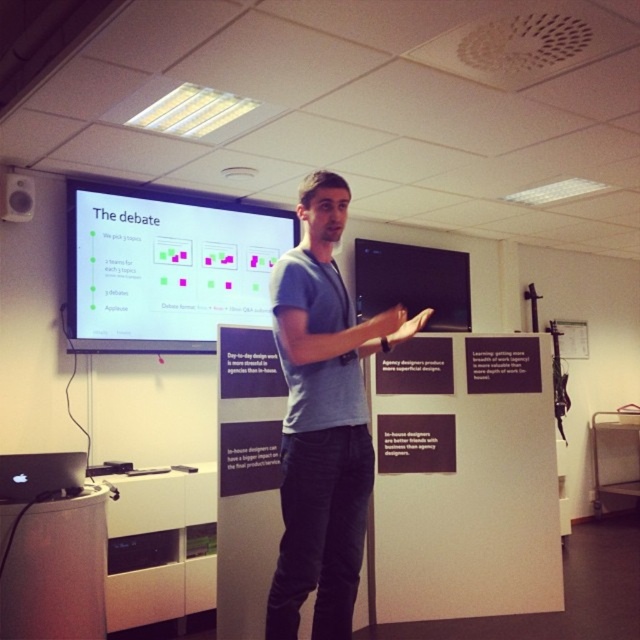
Who is positioned more to the right, black matte poster at center or white glossy projection screen at upper center?

From the viewer's perspective, black matte poster at center appears more on the right side.

Does point (452, 552) lie in front of point (74, 296)?

No, it is behind (74, 296).

This screenshot has height=640, width=640. In order to click on black matte poster at center in this screenshot , I will do `click(461, 481)`.

From the picture: Which of these two, black matte poster at center or blue cotton shirt at center, stands taller?

Standing taller between the two is blue cotton shirt at center.

Image resolution: width=640 pixels, height=640 pixels. What are the coordinates of `black matte poster at center` in the screenshot? It's located at (461, 481).

From the picture: Is white glossy projection screen at upper center shorter than matte black speaker at upper left?

In fact, white glossy projection screen at upper center may be taller than matte black speaker at upper left.

Is point (180, 346) farther from viewer compared to point (29, 184)?

Yes, it is.

Locate an element on the screen. The image size is (640, 640). white glossy projection screen at upper center is located at coordinates (164, 268).